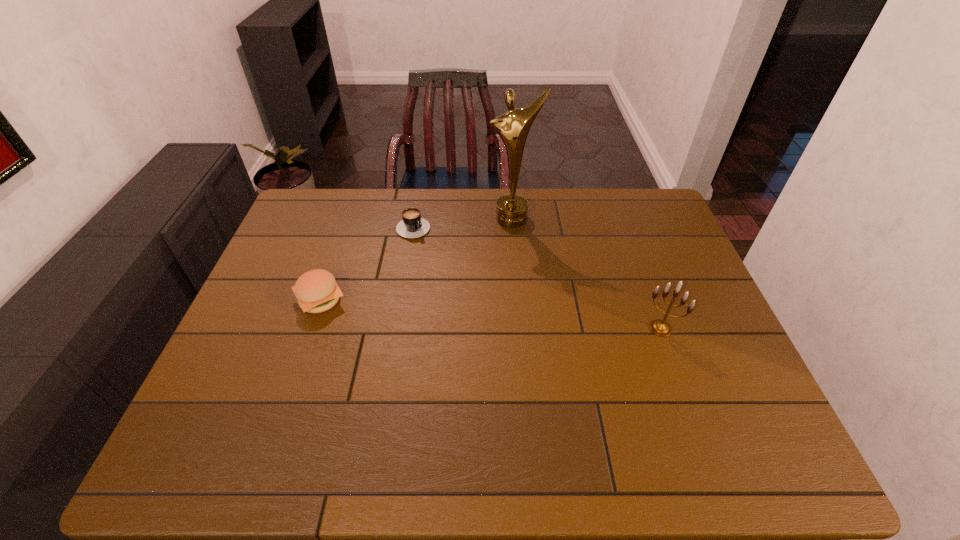
The height and width of the screenshot is (540, 960). I want to click on the leftmost object, so click(x=316, y=290).

Identify the location of hamburger. The height and width of the screenshot is (540, 960). (316, 290).

Identify the location of the rightmost object. (661, 328).

Identify the location of candelabrum. (661, 328).

Locate an element on the screen. The width and height of the screenshot is (960, 540). cappuccino is located at coordinates (412, 226).

Identify the location of the third object from right to left. (412, 226).

The image size is (960, 540). I want to click on the tallest object, so click(x=513, y=127).

This screenshot has height=540, width=960. Identify the location of the second object from right to left. (513, 127).

Where is `vacant space located 0.160m on the front of the second shortest object`? Image resolution: width=960 pixels, height=540 pixels. vacant space located 0.160m on the front of the second shortest object is located at coordinates (296, 373).

At what (x,y) coordinates should I click in order to perform the action: click on free space located 0.110m on the back of the candelabrum. Please return your answer as a coordinate pair (x, y). The height and width of the screenshot is (540, 960). Looking at the image, I should click on (646, 289).